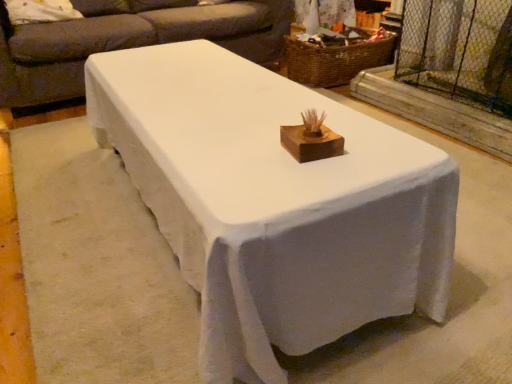
Question: From the image's perspective, would you say clear plastic screen door at upper right is positioned over woven brown basket at upper center?

Choices:
 (A) yes
 (B) no

Answer: (B)

Question: From a real-world perspective, is clear plastic screen door at upper right positioned under woven brown basket at upper center based on gravity?

Choices:
 (A) yes
 (B) no

Answer: (B)

Question: Is clear plastic screen door at upper right far away from woven brown basket at upper center?

Choices:
 (A) no
 (B) yes

Answer: (A)

Question: Is clear plastic screen door at upper right not within woven brown basket at upper center?

Choices:
 (A) yes
 (B) no

Answer: (A)

Question: Considering the relative sizes of clear plastic screen door at upper right and woven brown basket at upper center in the image provided, is clear plastic screen door at upper right wider than woven brown basket at upper center?

Choices:
 (A) yes
 (B) no

Answer: (B)

Question: Can you confirm if clear plastic screen door at upper right is shorter than woven brown basket at upper center?

Choices:
 (A) no
 (B) yes

Answer: (A)

Question: From the image's perspective, is wooden at center on woven brown basket at upper center?

Choices:
 (A) no
 (B) yes

Answer: (A)

Question: Does wooden at center have a greater width compared to woven brown basket at upper center?

Choices:
 (A) yes
 (B) no

Answer: (B)

Question: From the image's perspective, is wooden at center under woven brown basket at upper center?

Choices:
 (A) no
 (B) yes

Answer: (B)

Question: Is wooden at center smaller than woven brown basket at upper center?

Choices:
 (A) no
 (B) yes

Answer: (B)

Question: Is wooden at center thinner than woven brown basket at upper center?

Choices:
 (A) no
 (B) yes

Answer: (B)

Question: Can you confirm if wooden at center is shorter than woven brown basket at upper center?

Choices:
 (A) yes
 (B) no

Answer: (A)

Question: Could you tell me if woven brown basket at upper center is facing clear plastic screen door at upper right?

Choices:
 (A) yes
 (B) no

Answer: (B)